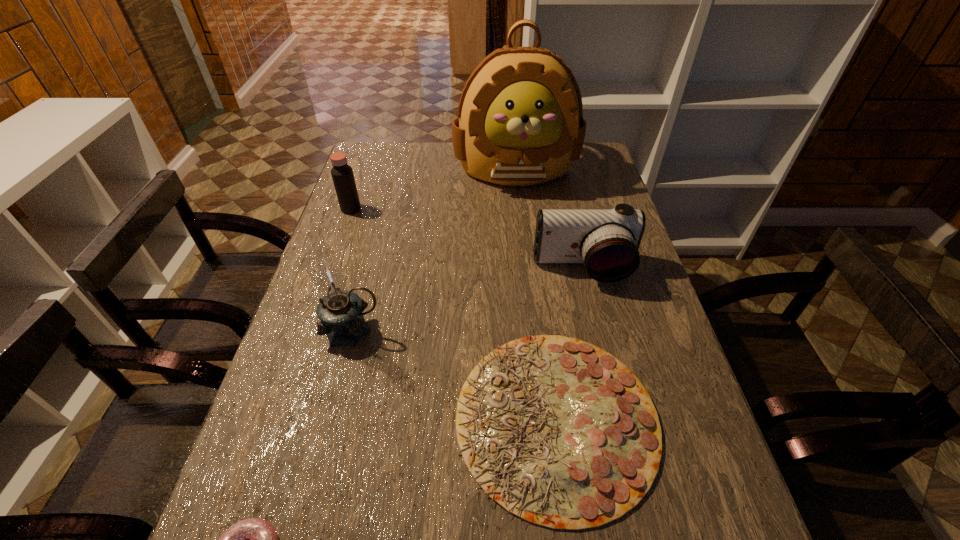
In the image, there is a desktop. Identify the location of free space at the right edge. (620, 355).

Where is `vacant space at the far left corner of the desktop`? vacant space at the far left corner of the desktop is located at coordinates [x=392, y=151].

The image size is (960, 540). I want to click on vacant point located between the pizza and the second tallest object, so click(x=455, y=374).

At what (x,y) coordinates should I click in order to perform the action: click on free spot between the second tallest object and the third farthest object. Please return your answer as a coordinate pair (x, y). The width and height of the screenshot is (960, 540). Looking at the image, I should click on tap(468, 299).

The height and width of the screenshot is (540, 960). I want to click on free area in between the pizza and the second farthest object, so click(x=454, y=314).

I want to click on vacant area that lies between the pizza and the fifth shortest object, so click(x=455, y=374).

Locate an element on the screen. The width and height of the screenshot is (960, 540). free space between the farthest object and the second tallest object is located at coordinates (435, 249).

Locate an element on the screen. blank region between the second tallest object and the vinegar is located at coordinates (352, 269).

The height and width of the screenshot is (540, 960). I want to click on free space between the oil lamp and the pizza, so click(455, 374).

The width and height of the screenshot is (960, 540). What are the coordinates of `vacant area that lies between the camcorder and the oil lamp` in the screenshot? It's located at (468, 299).